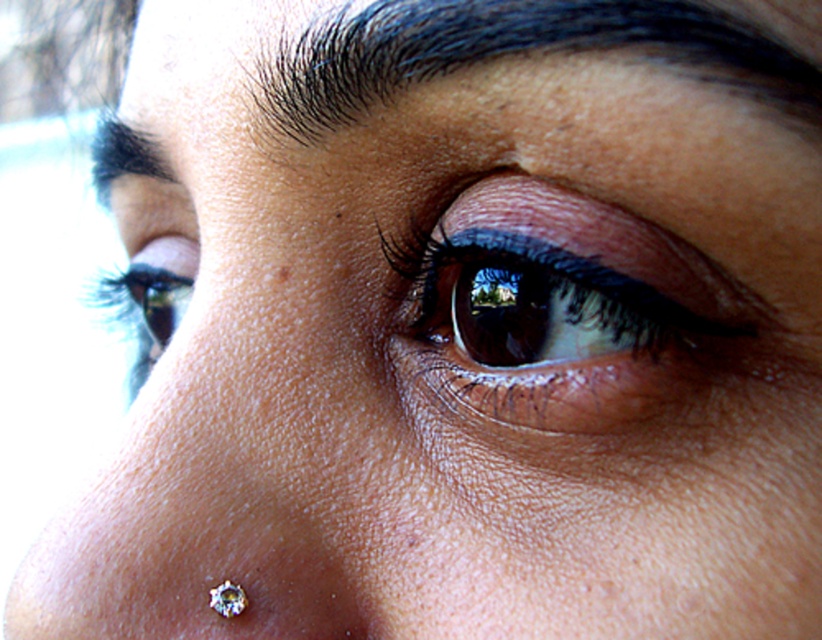
In the scene shown: You are a photographer adjusting the focus of your camera. You need to capture both the dark blue hair at upper center and the matte black eye at upper left in sharp focus. Given that your camera has a depth of field that can cover 10 inches, will both subjects be in focus?

The distance between the dark blue hair at upper center and the matte black eye at upper left is 10.87 inches. Since the depth of field can only cover 10 inches, the two subjects are slightly beyond the camera focus range, so it might not be possible to have both in sharp focus simultaneously.

Looking at the closeup of a person, you see the brown matte eye at center and the dark blue hair at upper center. Which object is positioned to the left?

The dark blue hair at upper center is positioned to the left of the brown matte eye at center.

You are a makeup artist analyzing the closeup of a face. You notice the dark blue hair at upper center and the matte black eye at upper left. Which object takes up more space in the image?

The matte black eye at upper left takes up more space than the dark blue hair at upper center.